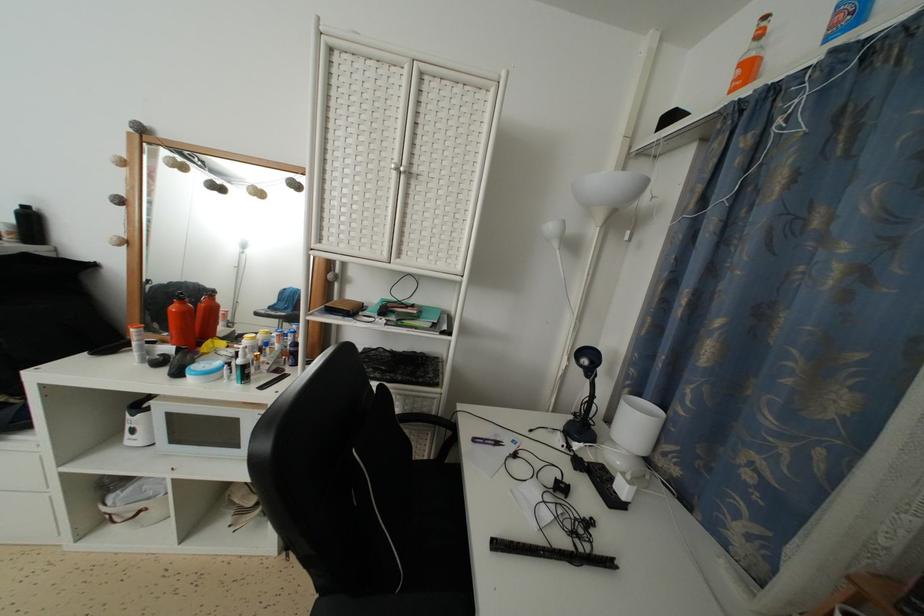
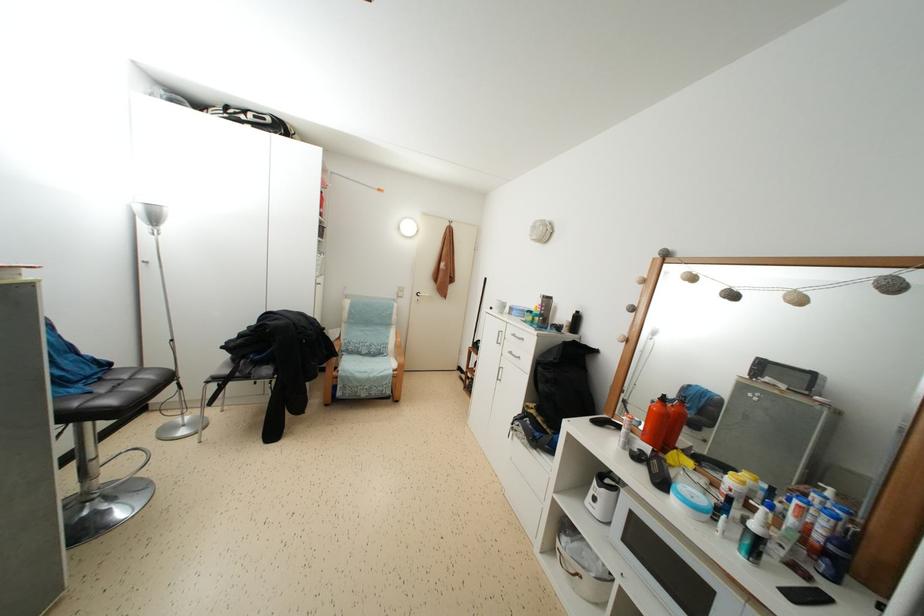
Question: Based on the continuous images, in which direction is the camera rotating? Reply with the corresponding letter.

Choices:
 (A) Left
 (B) Right
 (C) Up
 (D) Down

Answer: (A)